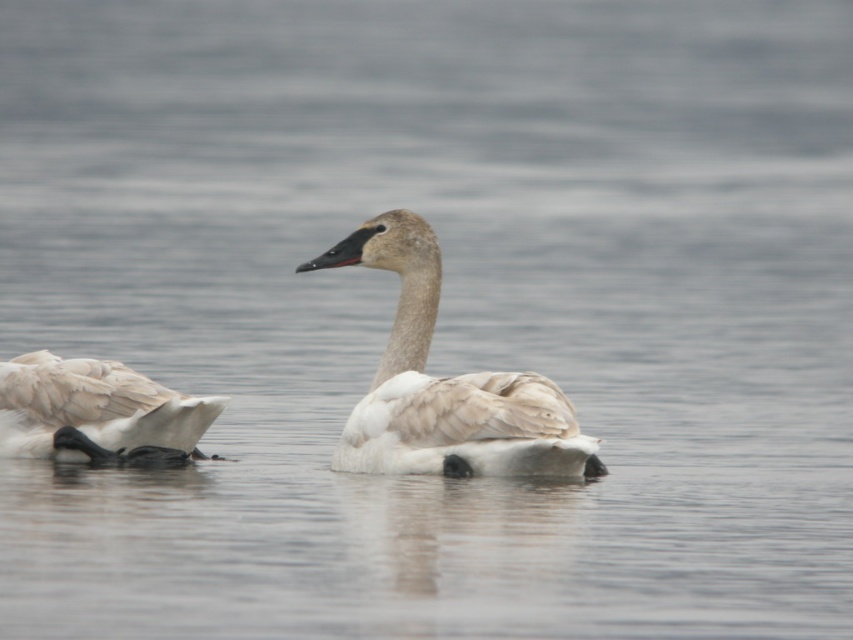
Question: Which object appears closest to the camera in this image?

Choices:
 (A) white feathered swan at center
 (B) white feathered duck at left

Answer: (A)

Question: Does white feathered swan at center have a lesser width compared to white feathered duck at left?

Choices:
 (A) no
 (B) yes

Answer: (A)

Question: Which object is closer to the camera taking this photo?

Choices:
 (A) white feathered duck at left
 (B) white feathered swan at center

Answer: (B)

Question: Is white feathered swan at center positioned behind white feathered duck at left?

Choices:
 (A) no
 (B) yes

Answer: (A)

Question: Where is white feathered swan at center located in relation to white feathered duck at left in the image?

Choices:
 (A) above
 (B) below

Answer: (B)